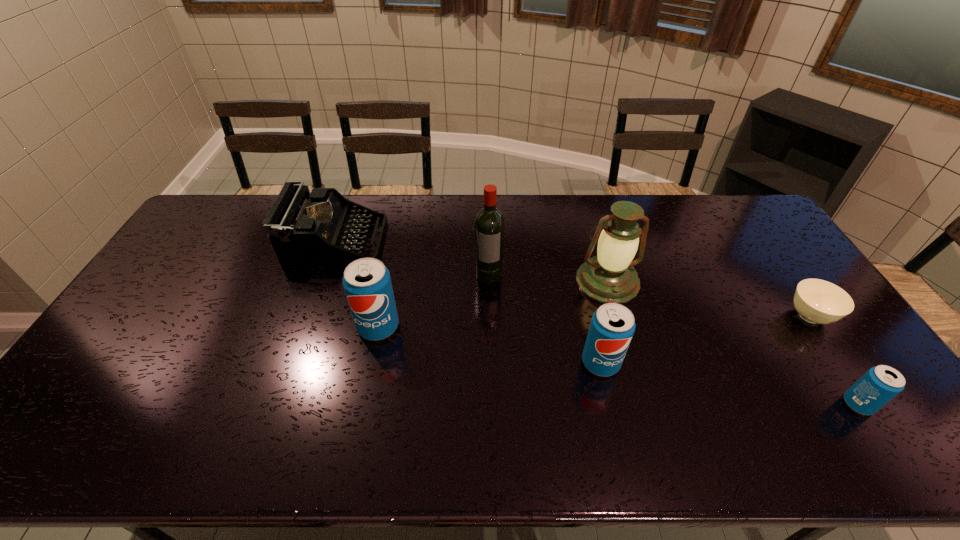
Locate an element on the screen. Image resolution: width=960 pixels, height=540 pixels. object that is at the near right corner is located at coordinates (880, 384).

Locate an element on the screen. blank space at the far edge is located at coordinates (447, 214).

Locate an element on the screen. blank space at the near edge of the desktop is located at coordinates (461, 411).

This screenshot has height=540, width=960. In order to click on free space at the left edge in this screenshot , I will do `click(228, 234)`.

Identify the location of free spot at the right edge of the desktop. (781, 288).

The width and height of the screenshot is (960, 540). In order to click on vacant space that's between the fifth object from right to left and the third shortest object in this screenshot , I will do `click(412, 258)`.

Identify the location of free spot between the second nearest soda can and the shortest object. (705, 340).

The height and width of the screenshot is (540, 960). In order to click on blank region between the second nearest soda can and the shortest object in this screenshot , I will do `click(705, 340)`.

Image resolution: width=960 pixels, height=540 pixels. Identify the location of vacant point located between the wine bottle and the shortest object. (649, 295).

The image size is (960, 540). Find the location of `unoccupied area between the rightmost soda can and the second soda can from left to right`. unoccupied area between the rightmost soda can and the second soda can from left to right is located at coordinates (730, 383).